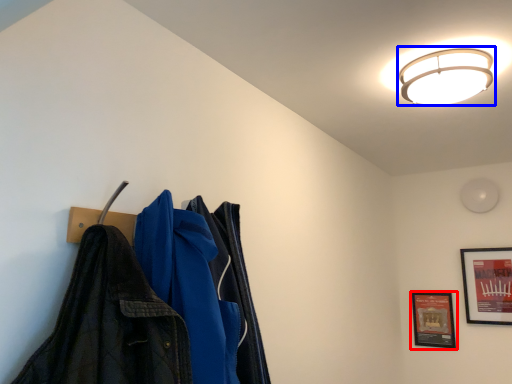
Question: Which object is closer to the camera taking this photo, picture frame (highlighted by a red box) or lamp (highlighted by a blue box)?

Choices:
 (A) picture frame
 (B) lamp

Answer: (B)